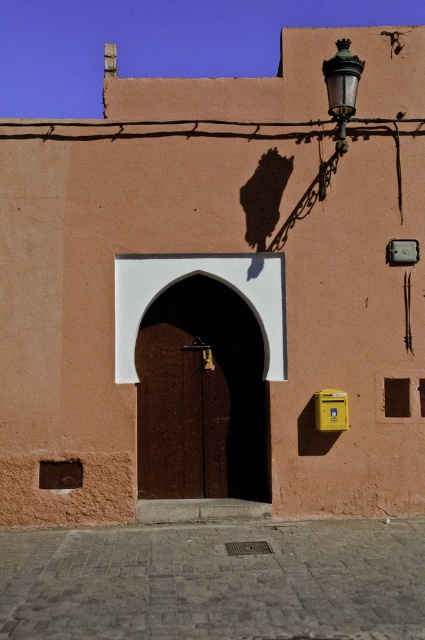
Question: Is brown wooden door at center above green glass streetlamp at upper right?

Choices:
 (A) yes
 (B) no

Answer: (B)

Question: Among these objects, which one is nearest to the camera?

Choices:
 (A) brown wooden door at center
 (B) green glass streetlamp at upper right

Answer: (B)

Question: Among these points, which one is farthest from the camera?

Choices:
 (A) (119, 330)
 (B) (348, 52)

Answer: (A)

Question: Is brown wooden door at center in front of green glass streetlamp at upper right?

Choices:
 (A) yes
 (B) no

Answer: (B)

Question: Can you confirm if brown wooden door at center is positioned above green glass streetlamp at upper right?

Choices:
 (A) yes
 (B) no

Answer: (B)